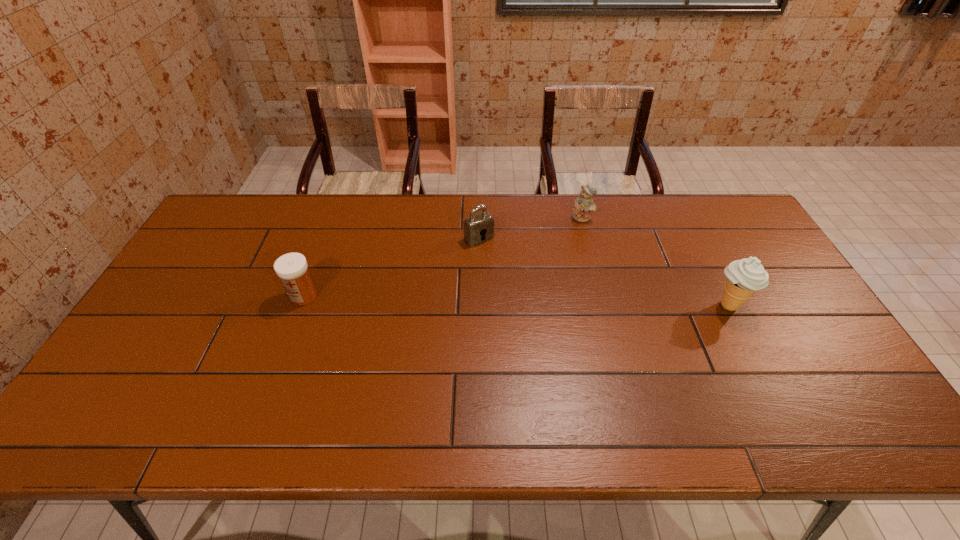
You are a GUI agent. You are given a task and a screenshot of the screen. Output one action in this format:
    pyautogui.click(x=<x>, y=<y>)
    Task: Click on the leftmost object
    
    Given the screenshot: What is the action you would take?
    coord(292,268)

At what (x,y) coordinates should I click in order to perform the action: click on the tallest object. Please return your answer as a coordinate pair (x, y). This screenshot has height=540, width=960. Looking at the image, I should click on (744, 277).

What are the coordinates of `icecream` in the screenshot? It's located at (744, 277).

Where is `padlock`? Image resolution: width=960 pixels, height=540 pixels. padlock is located at coordinates (479, 227).

The width and height of the screenshot is (960, 540). What are the coordinates of `the third object from right to left` in the screenshot? It's located at (479, 227).

You are a GUI agent. You are given a task and a screenshot of the screen. Output one action in this format:
    pyautogui.click(x=<x>, y=<y>)
    Task: Click on the farthest object
    The image size is (960, 540).
    Given the screenshot: What is the action you would take?
    tap(584, 204)

Where is `the third object from left to right`? The width and height of the screenshot is (960, 540). the third object from left to right is located at coordinates (584, 204).

Find the location of a particular element. vacant space positioned on the left of the medicine is located at coordinates (184, 296).

Identify the location of vacant point located 0.090m on the right of the tallest object. Image resolution: width=960 pixels, height=540 pixels. 780,306.

Identify the location of free space located at the front of the padlock near the keyhole. The height and width of the screenshot is (540, 960). (563, 333).